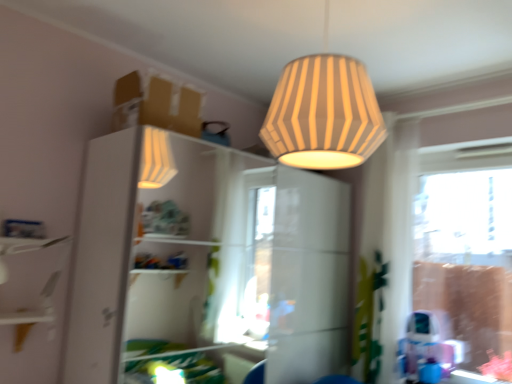
Where is `striped paper lampshade at upper center`? striped paper lampshade at upper center is located at coordinates (323, 114).

Locate an element on the screen. The height and width of the screenshot is (384, 512). white glossy dresser at upper center is located at coordinates (205, 262).

Which is closer to the camera, [6,362] or [286,371]?

Clearly, point [6,362] is closer to the camera than point [286,371].

From a real-world perspective, is white glossy shelf at left physically located above or below white glossy dresser at upper center?

In terms of real-world spatial position, white glossy shelf at left is above white glossy dresser at upper center.

In terms of width, does white glossy shelf at left look wider or thinner when compared to clear glass window at right?

white glossy shelf at left is wider than clear glass window at right.

From a real-world perspective, is white glossy shelf at left under clear glass window at right?

Yes, from a real-world perspective, white glossy shelf at left is under clear glass window at right.

Is clear glass window at right inside white glossy shelf at left?

No.

Does striped paper lampshade at upper center lie behind clear glass window at right?

No, striped paper lampshade at upper center is in front of clear glass window at right.

Is striped paper lampshade at upper center in contact with clear glass window at right?

No, striped paper lampshade at upper center is not making contact with clear glass window at right.

From a real-world perspective, which object rests below the other?

clear glass window at right, from a real-world perspective.

Could you tell me if white glossy dresser at upper center is turned towards white glossy shelf at left?

No, white glossy dresser at upper center is not oriented towards white glossy shelf at left.

Is white glossy dresser at upper center next to white glossy shelf at left?

They are not placed beside each other.

Which is more to the left, white glossy dresser at upper center or white glossy shelf at left?

From the viewer's perspective, white glossy shelf at left appears more on the left side.

Is there a large distance between clear glass window at right and white glossy dresser at upper center?

Absolutely, clear glass window at right is distant from white glossy dresser at upper center.

Identify the location of dresser in front of the clear glass window at right. (205, 262).

Is clear glass window at right in front of white glossy dresser at upper center?

No.

In terms of size, does striped paper lampshade at upper center appear bigger or smaller than white glossy dresser at upper center?

In the image, striped paper lampshade at upper center appears to be smaller than white glossy dresser at upper center.

You are a GUI agent. You are given a task and a screenshot of the screen. Output one action in this format:
    pyautogui.click(x=<x>, y=<y>)
    Task: Click on the lamp above the white glossy dresser at upper center (from a real-world perspective)
    Image resolution: width=512 pixels, height=384 pixels.
    Given the screenshot: What is the action you would take?
    pyautogui.click(x=323, y=114)

From the image's perspective, is striped paper lampshade at upper center on top of white glossy dresser at upper center?

Yes.

Can you see striped paper lampshade at upper center touching white glossy dresser at upper center?

No, striped paper lampshade at upper center is not touching white glossy dresser at upper center.

Is white glossy dresser at upper center to the right of clear glass window at right from the viewer's perspective?

No, white glossy dresser at upper center is not to the right of clear glass window at right.

Does point (328, 323) lie behind point (423, 229)?

Yes, point (328, 323) is behind point (423, 229).

Is white glossy dresser at upper center turned away from clear glass window at right?

white glossy dresser at upper center is not turned away from clear glass window at right.

Is clear glass window at right located within white glossy dresser at upper center?

Actually, clear glass window at right is outside white glossy dresser at upper center.

Where is `dresser behind the white glossy shelf at left`? Image resolution: width=512 pixels, height=384 pixels. dresser behind the white glossy shelf at left is located at coordinates (205, 262).

In order to click on shelf directly beneath the clear glass window at right (from a real-world perspective) in this screenshot , I will do `click(31, 278)`.

Estimate the real-world distances between objects in this image. Which object is closer to white glossy dresser at upper center, striped paper lampshade at upper center or white glossy shelf at left?

Among the two, white glossy shelf at left is located nearer to white glossy dresser at upper center.

When comparing their distances from white glossy shelf at left, does striped paper lampshade at upper center or white glossy dresser at upper center seem closer?

striped paper lampshade at upper center is closer to white glossy shelf at left.

Which object lies nearer to the anchor point clear glass window at right, striped paper lampshade at upper center or white glossy shelf at left?

Based on the image, striped paper lampshade at upper center appears to be nearer to clear glass window at right.

Which object lies further to the anchor point striped paper lampshade at upper center, clear glass window at right or white glossy dresser at upper center?

white glossy dresser at upper center.

Estimate the real-world distances between objects in this image. Which object is closer to clear glass window at right, striped paper lampshade at upper center or white glossy dresser at upper center?

striped paper lampshade at upper center.

Looking at the image, which one is located further to striped paper lampshade at upper center, white glossy shelf at left or white glossy dresser at upper center?

white glossy dresser at upper center.

Consider the image. From the image, which object appears to be nearer to white glossy dresser at upper center, white glossy shelf at left or striped paper lampshade at upper center?

The object closer to white glossy dresser at upper center is white glossy shelf at left.

When comparing their distances from white glossy dresser at upper center, does clear glass window at right or striped paper lampshade at upper center seem further?

striped paper lampshade at upper center lies further to white glossy dresser at upper center than the other object.

Find the location of a particular element. lamp between white glossy shelf at left and clear glass window at right in the horizontal direction is located at coordinates pos(323,114).

The image size is (512, 384). What are the coordinates of `lamp between white glossy dresser at upper center and clear glass window at right in the horizontal direction` in the screenshot? It's located at (323, 114).

Find the location of a particular element. dresser located between white glossy shelf at left and clear glass window at right in the left-right direction is located at coordinates (205, 262).

Locate an element on the screen. This screenshot has height=384, width=512. dresser between white glossy shelf at left and striped paper lampshade at upper center in the horizontal direction is located at coordinates (205, 262).